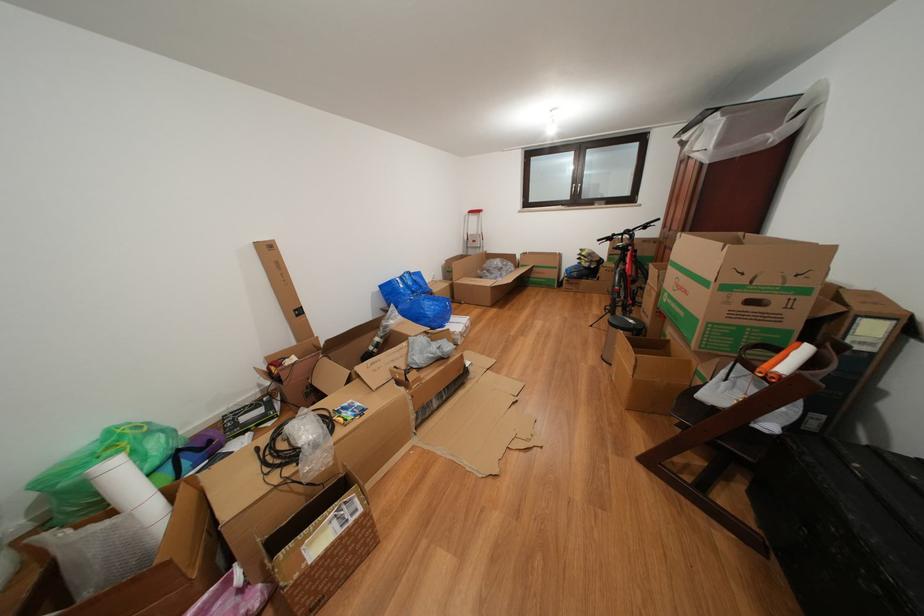
What do you see at coordinates (577, 193) in the screenshot? The image size is (924, 616). I see `a window handle` at bounding box center [577, 193].